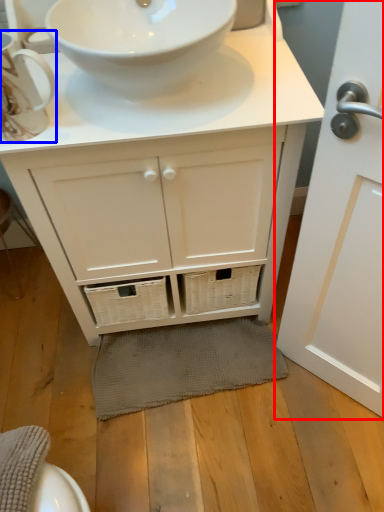
Question: Which object is closer to the camera taking this photo, door (highlighted by a red box) or teacup (highlighted by a blue box)?

Choices:
 (A) door
 (B) teacup

Answer: (A)